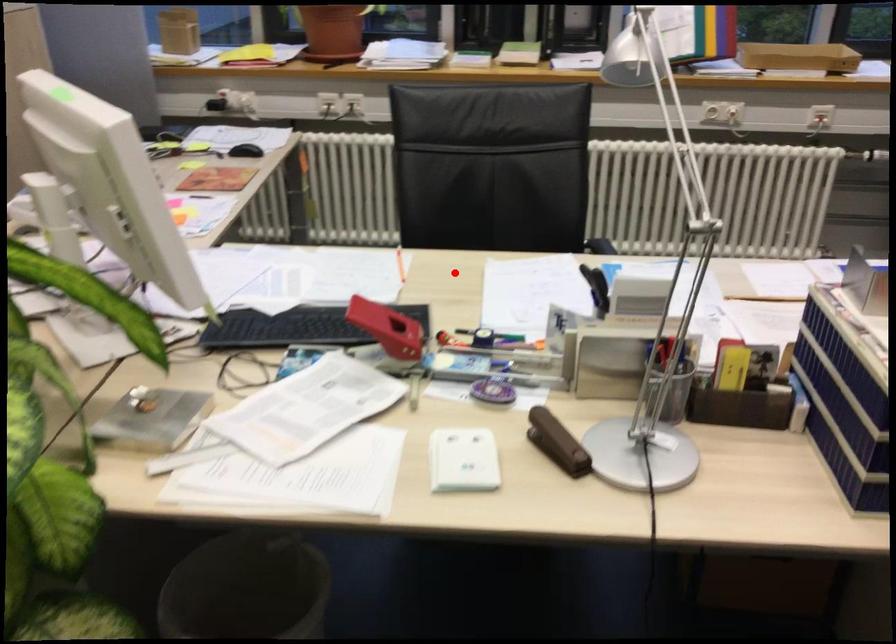
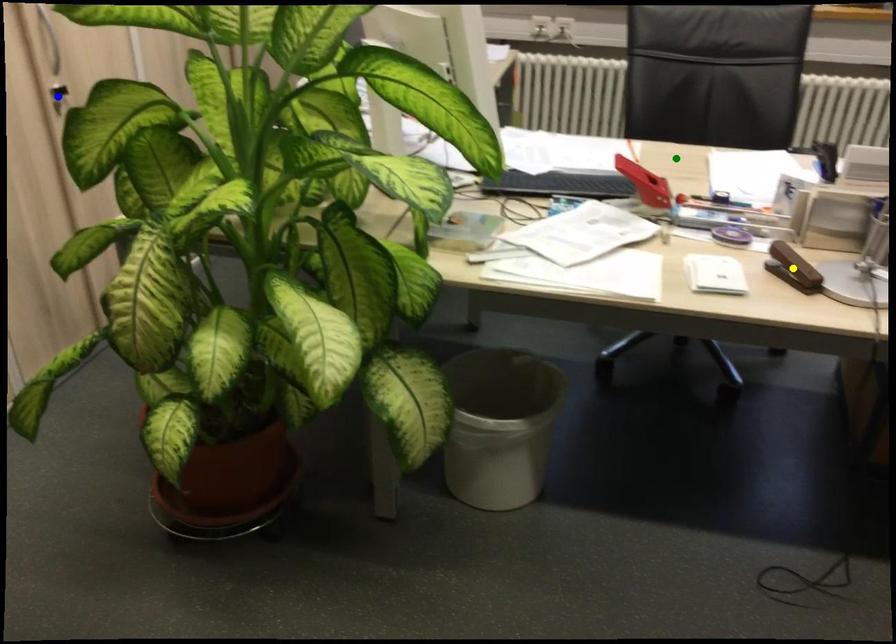
Question: I am providing you with two images of the same scene from different viewpoints. A red point is marked on the first image. You are given multiple points on the second image. Which spot in image 2 lines up with the point in image 1?

Choices:
 (A) blue point
 (B) green point
 (C) yellow point

Answer: (B)